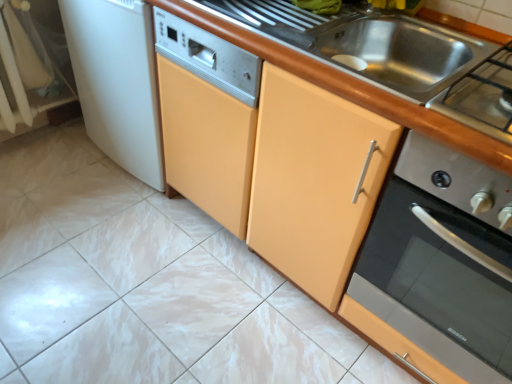
In order to click on blank space above white glossy ceramic tile at center (from a real-world perspective) in this screenshot , I will do coord(166,300).